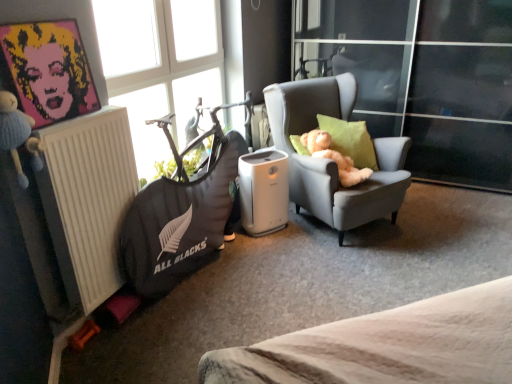
Image resolution: width=512 pixels, height=384 pixels. I want to click on free location above white matte radiator at left (from a real-world perspective), so click(69, 114).